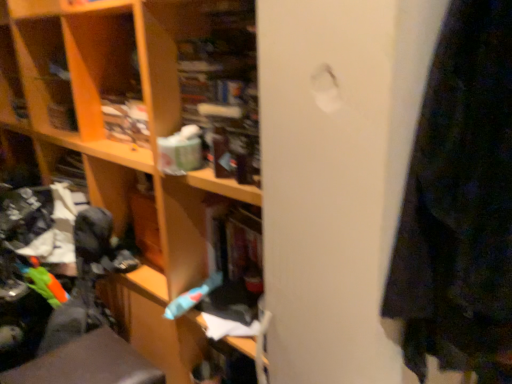
What do you see at coordinates (88, 363) in the screenshot? The height and width of the screenshot is (384, 512). I see `metallic gray swivel chair at lower left` at bounding box center [88, 363].

In order to click on metallic gray swivel chair at lower left in this screenshot , I will do `click(88, 363)`.

What is the approximate height of metallic gray swivel chair at lower left?

The height of metallic gray swivel chair at lower left is 12.99 inches.

This screenshot has width=512, height=384. Identify the location of rubberized blue toothbrush at center. (192, 296).

The image size is (512, 384). What do you see at coordinates (192, 296) in the screenshot?
I see `rubberized blue toothbrush at center` at bounding box center [192, 296].

Where is `metallic gray swivel chair at lower left`? metallic gray swivel chair at lower left is located at coordinates (88, 363).

Which is more to the left, rubberized blue toothbrush at center or metallic gray swivel chair at lower left?

From the viewer's perspective, metallic gray swivel chair at lower left appears more on the left side.

Is the position of rubberized blue toothbrush at center less distant than that of metallic gray swivel chair at lower left?

No, rubberized blue toothbrush at center is further to the viewer.

Which is in front, point (187, 297) or point (129, 354)?

Point (187, 297)

From the image's perspective, is rubberized blue toothbrush at center beneath metallic gray swivel chair at lower left?

No, from the image's perspective, rubberized blue toothbrush at center is not beneath metallic gray swivel chair at lower left.

From a real-world perspective, which object rests below the other?

metallic gray swivel chair at lower left.

Which of these two, rubberized blue toothbrush at center or metallic gray swivel chair at lower left, is wider?

metallic gray swivel chair at lower left is wider.

Does rubberized blue toothbrush at center have a greater height compared to metallic gray swivel chair at lower left?

Incorrect, the height of rubberized blue toothbrush at center is not larger of that of metallic gray swivel chair at lower left.

Who is bigger, rubberized blue toothbrush at center or metallic gray swivel chair at lower left?

With larger size is metallic gray swivel chair at lower left.

Could metallic gray swivel chair at lower left be considered to be inside rubberized blue toothbrush at center?

Actually, metallic gray swivel chair at lower left is outside rubberized blue toothbrush at center.

Are rubberized blue toothbrush at center and metallic gray swivel chair at lower left located far from each other?

No, there isn't a large distance between rubberized blue toothbrush at center and metallic gray swivel chair at lower left.

Consider the image. Is rubberized blue toothbrush at center facing towards metallic gray swivel chair at lower left?

No, rubberized blue toothbrush at center does not turn towards metallic gray swivel chair at lower left.

Looking at this image, how distant is rubberized blue toothbrush at center from metallic gray swivel chair at lower left?

rubberized blue toothbrush at center is 14.72 inches away from metallic gray swivel chair at lower left.

In order to click on swivel chair that appears below the rubberized blue toothbrush at center (from the image's perspective) in this screenshot , I will do `click(88, 363)`.

Which is more to the right, metallic gray swivel chair at lower left or rubberized blue toothbrush at center?

From the viewer's perspective, rubberized blue toothbrush at center appears more on the right side.

Is metallic gray swivel chair at lower left further to camera compared to rubberized blue toothbrush at center?

No, it is in front of rubberized blue toothbrush at center.

Is point (109, 347) closer to camera compared to point (220, 276)?

No, (109, 347) is behind (220, 276).

From the image's perspective, between metallic gray swivel chair at lower left and rubberized blue toothbrush at center, who is located below?

From the image's view, metallic gray swivel chair at lower left is below.

From a real-world perspective, is metallic gray swivel chair at lower left positioned above or below rubberized blue toothbrush at center?

From a real-world perspective, metallic gray swivel chair at lower left is physically below rubberized blue toothbrush at center.

Does metallic gray swivel chair at lower left have a greater width compared to rubberized blue toothbrush at center?

Yes, metallic gray swivel chair at lower left is wider than rubberized blue toothbrush at center.

Is metallic gray swivel chair at lower left taller than rubberized blue toothbrush at center?

Indeed, metallic gray swivel chair at lower left has a greater height compared to rubberized blue toothbrush at center.

Considering the relative sizes of metallic gray swivel chair at lower left and rubberized blue toothbrush at center in the image provided, is metallic gray swivel chair at lower left bigger than rubberized blue toothbrush at center?

Indeed, metallic gray swivel chair at lower left has a larger size compared to rubberized blue toothbrush at center.

In the scene shown: Is metallic gray swivel chair at lower left located outside rubberized blue toothbrush at center?

metallic gray swivel chair at lower left is positioned outside rubberized blue toothbrush at center.

Is there a large distance between metallic gray swivel chair at lower left and rubberized blue toothbrush at center?

No, there isn't a large distance between metallic gray swivel chair at lower left and rubberized blue toothbrush at center.

Is metallic gray swivel chair at lower left facing towards rubberized blue toothbrush at center?

No, metallic gray swivel chair at lower left is not oriented towards rubberized blue toothbrush at center.

How many degrees apart are the facing directions of metallic gray swivel chair at lower left and rubberized blue toothbrush at center?

89.5 degrees.

Could you measure the distance between metallic gray swivel chair at lower left and rubberized blue toothbrush at center?

37.39 centimeters.

In order to click on toy that is on the right side of metallic gray swivel chair at lower left in this screenshot , I will do `click(192, 296)`.

Find the location of a particular element. The height and width of the screenshot is (384, 512). swivel chair that is below the rubberized blue toothbrush at center (from the image's perspective) is located at coordinates (88, 363).

Image resolution: width=512 pixels, height=384 pixels. Identify the location of swivel chair located in front of the rubberized blue toothbrush at center. (88, 363).